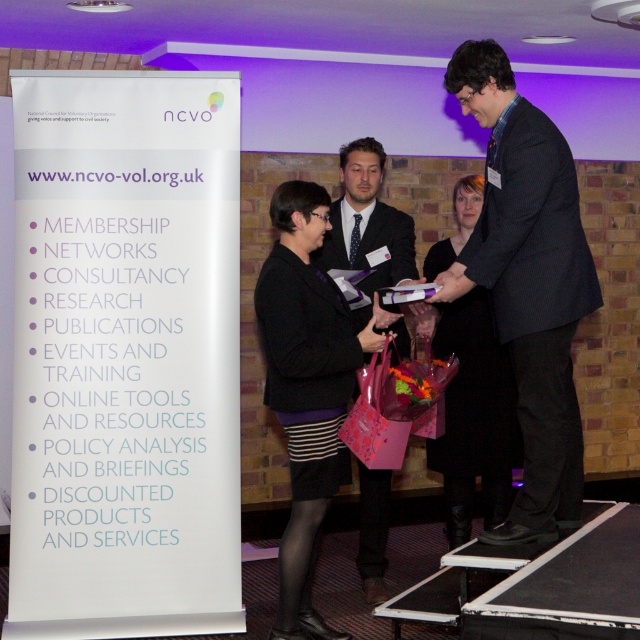
You are a photographer at the event and need to capture a photo of both the black textured suit at center and the matte black suit at center. Which one should you focus on first if you want to ensure the taller one is in focus?

The black textured suit at center is taller than the matte black suit at center, so you should focus on the black textured suit at center first to ensure the taller one is in focus.

What is the spatial relationship between the black textured skirt at center and any other objects in the scene?

The black textured skirt at center is located at point (307,387) in the scene.